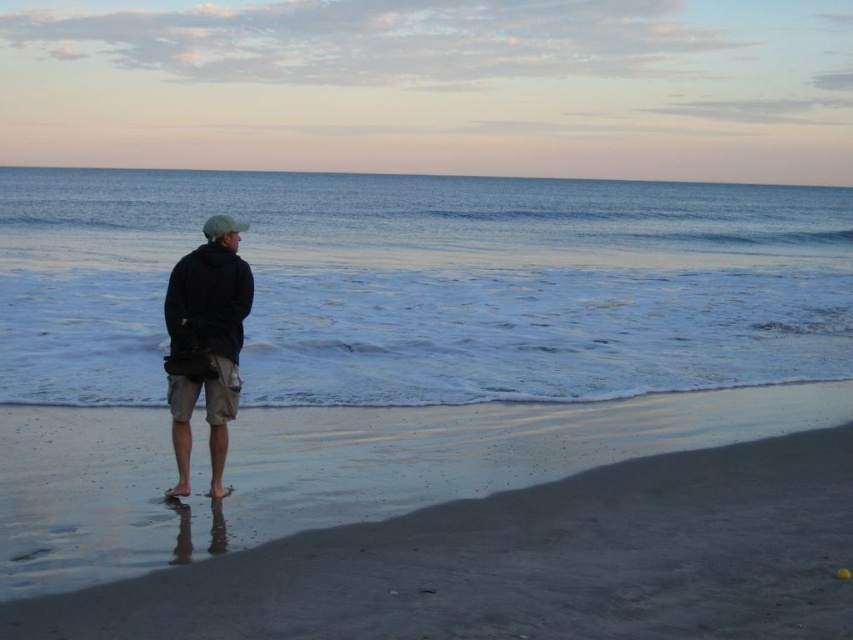
Does blue smooth water at center have a smaller size compared to dark blue fabric jacket at center?

No.

Looking at this image, does blue smooth water at center have a greater width compared to dark blue fabric jacket at center?

Yes, blue smooth water at center is wider than dark blue fabric jacket at center.

Is point (567, 317) in front of point (173, 396)?

No, it is behind (173, 396).

Find the location of a particular element. blue smooth water at center is located at coordinates (427, 285).

Who is more forward, [590,563] or [178,458]?

Point [590,563] is in front.

Does dark sand at lower left have a lesser width compared to dark blue fabric jacket at center?

No.

Is point (601, 467) positioned before point (200, 289)?

No.

The image size is (853, 640). What are the coordinates of `dark sand at lower left` in the screenshot? It's located at (442, 522).

This screenshot has width=853, height=640. What do you see at coordinates (442, 522) in the screenshot?
I see `dark sand at lower left` at bounding box center [442, 522].

Can you confirm if dark sand at lower left is taller than blue smooth water at center?

Incorrect, dark sand at lower left's height is not larger of blue smooth water at center's.

At what (x,y) coordinates should I click in order to perform the action: click on dark sand at lower left. Please return your answer as a coordinate pair (x, y). The image size is (853, 640). Looking at the image, I should click on (442, 522).

Where is `dark sand at lower left`? dark sand at lower left is located at coordinates (442, 522).